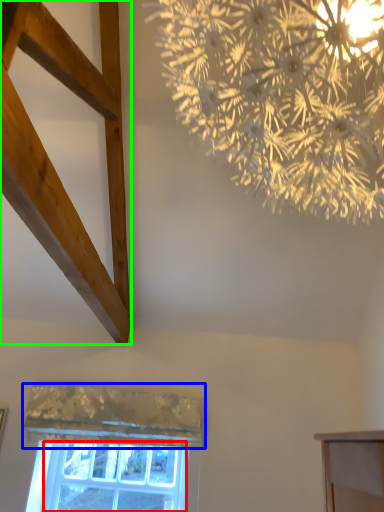
Question: Which object is positioned closest to window screen (highlighted by a red box)? Select from curtain (highlighted by a blue box) and plank (highlighted by a green box).

Choices:
 (A) curtain
 (B) plank

Answer: (A)